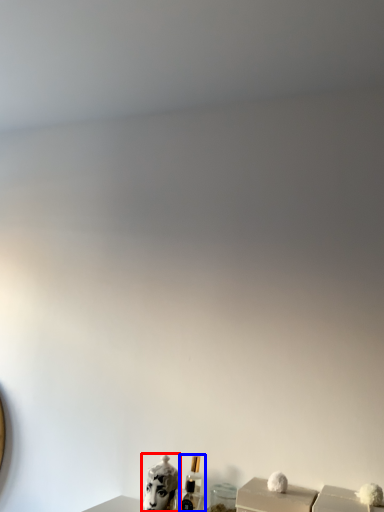
Question: Which object appears farthest to the camera in this image, animal (highlighted by a red box) or perfume (highlighted by a blue box)?

Choices:
 (A) animal
 (B) perfume

Answer: (B)